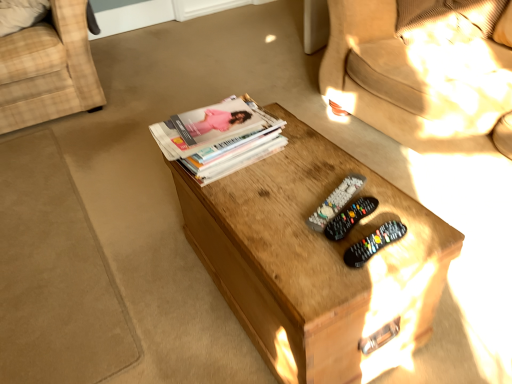
Question: In terms of height, does white glossy magazine stack at center look taller or shorter compared to wooden coffee table at center?

Choices:
 (A) tall
 (B) short

Answer: (B)

Question: From a real-world perspective, is white glossy magazine stack at center positioned above or below wooden coffee table at center?

Choices:
 (A) below
 (B) above

Answer: (B)

Question: Considering the real-world distances, which object is farthest from the white glossy magazine stack at center?

Choices:
 (A) black plastic remote control at center, the 2th remote control positioned from the front
 (B) wooden coffee table at center
 (C) black plastic remote controls at center, acting as the third remote control starting from the back
 (D) black plastic remote at center, which is the 3th remote control from front to back
 (E) plaid fabric chair at left

Answer: (E)

Question: Considering the real-world distances, which object is farthest from the plaid fabric chair at left?

Choices:
 (A) black plastic remote at center, which is the 3th remote control from front to back
 (B) white glossy magazine stack at center
 (C) black plastic remote controls at center, which ranks as the first remote control in front-to-back order
 (D) wooden coffee table at center
 (E) black plastic remote control at center, the 2th remote control positioned from the front

Answer: (C)